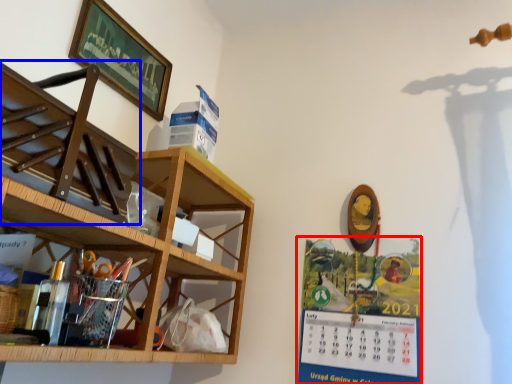
Question: Which object appears farthest to the camera in this image, poster (highlighted by a red box) or shelf (highlighted by a blue box)?

Choices:
 (A) poster
 (B) shelf

Answer: (A)